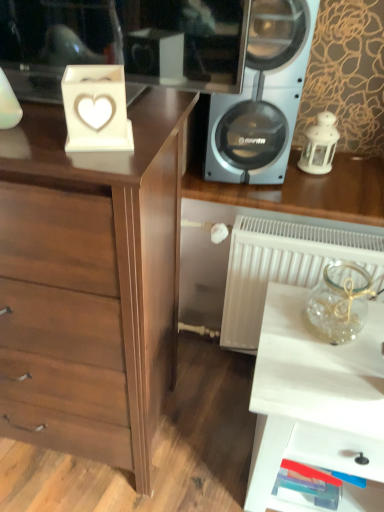
The height and width of the screenshot is (512, 384). I want to click on free space to the left of clear glass jar at right, so click(x=280, y=325).